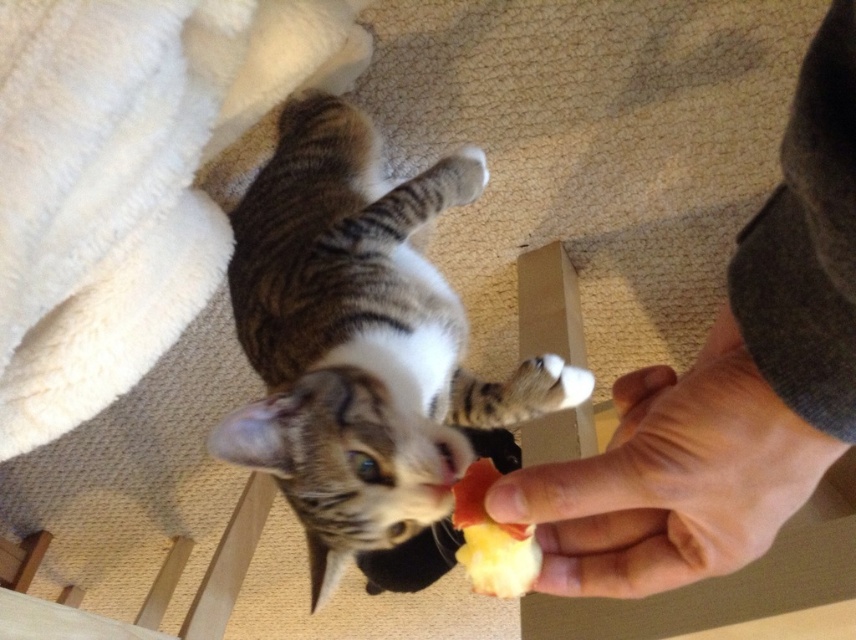
Which of these two, smooth skin hand at lower right or yellowish matte apple slice at center, stands taller?

Standing taller between the two is smooth skin hand at lower right.

Can you confirm if smooth skin hand at lower right is shorter than yellowish matte apple slice at center?

Incorrect, smooth skin hand at lower right's height does not fall short of yellowish matte apple slice at center's.

Is point (702, 506) closer to viewer compared to point (458, 554)?

Yes.

The image size is (856, 640). What are the coordinates of `smooth skin hand at lower right` in the screenshot? It's located at (670, 481).

Which is in front, point (405, 307) or point (495, 570)?

Point (495, 570)

Who is lower down, tabby fur cat at center or yellowish matte apple slice at center?

yellowish matte apple slice at center is below.

Is point (286, 413) closer to viewer compared to point (527, 532)?

No, it is not.

Where is `tabby fur cat at center`? The image size is (856, 640). tabby fur cat at center is located at coordinates (361, 340).

Is tabby fur cat at center above smooth skin hand at lower right?

Yes.

Is tabby fur cat at center wider than smooth skin hand at lower right?

Indeed, tabby fur cat at center has a greater width compared to smooth skin hand at lower right.

Does point (296, 506) come farther from viewer compared to point (615, 488)?

That is True.

This screenshot has height=640, width=856. Find the location of `tabby fur cat at center`. tabby fur cat at center is located at coordinates (361, 340).